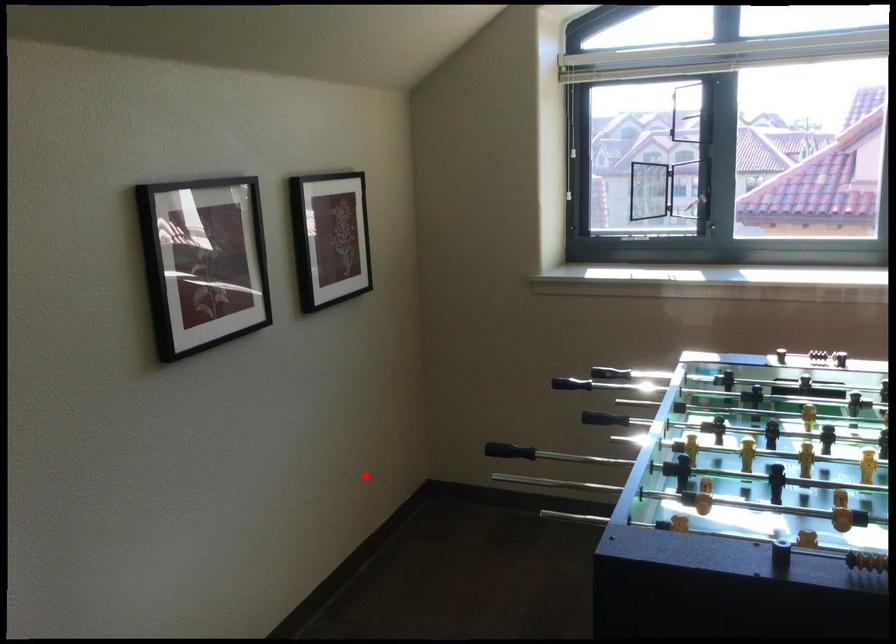
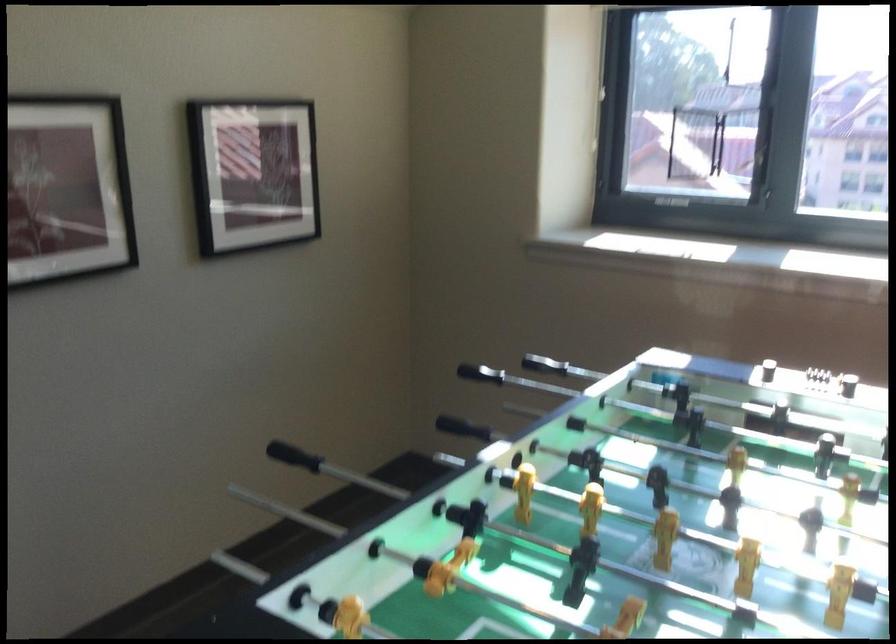
Question: I am providing you with two images of the same scene from different viewpoints. Given a red point in image1, look at the same physical point in image2. Is it:

Choices:
 (A) Closer to the viewpoint
 (B) Farther from the viewpoint

Answer: (A)